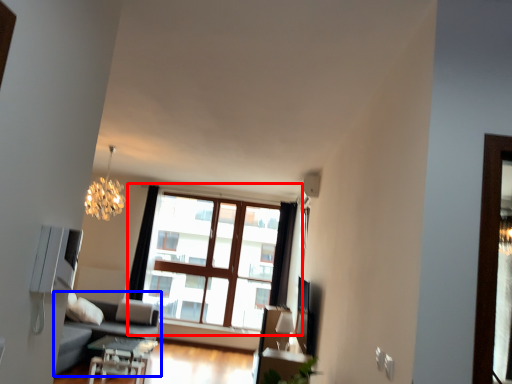
Question: Which object appears closest to the camera in this image, window (highlighted by a red box) or studio couch (highlighted by a blue box)?

Choices:
 (A) window
 (B) studio couch

Answer: (B)